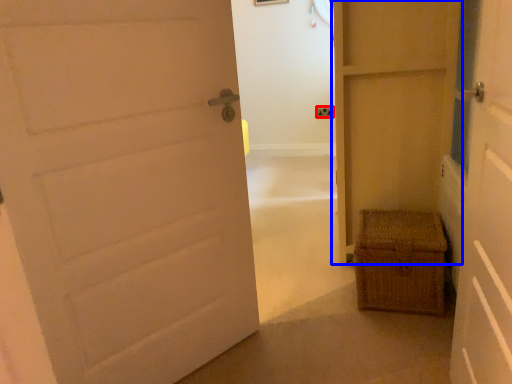
Question: Which object is closer to the camera taking this photo, electric outlet (highlighted by a red box) or door (highlighted by a blue box)?

Choices:
 (A) electric outlet
 (B) door

Answer: (B)